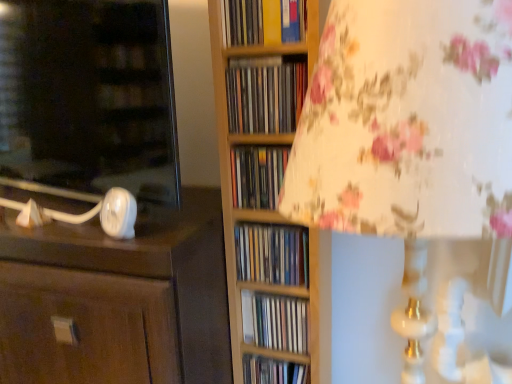
Locate an element on the screen. The height and width of the screenshot is (384, 512). matte plastic books at center, the 4th book from the bottom is located at coordinates (257, 175).

The height and width of the screenshot is (384, 512). What are the coordinates of `wooden cd case at center, the fifth book in the bottom-to-top sequence` in the screenshot? It's located at (265, 97).

This screenshot has width=512, height=384. In order to click on matte plastic books at center, which appears as the 3th book when ordered from the bottom in this screenshot , I will do `click(272, 254)`.

What do you see at coordinates (263, 21) in the screenshot? The image size is (512, 384). I see `yellow paperback book at upper center, acting as the sixth book starting from the bottom` at bounding box center [263, 21].

This screenshot has width=512, height=384. I want to click on matte plastic books at center, which is the 5th book in top-to-bottom order, so click(x=275, y=322).

How distant is matte plastic books at center, the 1th book from the bottom, from matte brown cabinet at left?

14.63 inches.

From a real-world perspective, who is located lower, matte plastic books at center, which ranks as the sixth book in top-to-bottom order, or matte brown cabinet at left?

From a 3D spatial view, matte plastic books at center, which ranks as the sixth book in top-to-bottom order, is below.

Could you tell me if matte plastic books at center, the 1th book from the bottom, is turned towards matte brown cabinet at left?

No, matte plastic books at center, the 1th book from the bottom, is not oriented towards matte brown cabinet at left.

Identify the location of chest of drawers in front of the matte plastic books at center, which ranks as the sixth book in top-to-bottom order. (118, 299).

Which is more to the left, matte plastic books at center, which is the 5th book in top-to-bottom order, or matte plastic books at center, which ranks as the sixth book in top-to-bottom order?

matte plastic books at center, which is the 5th book in top-to-bottom order.

From the image's perspective, between matte plastic books at center, which is the second book in bottom-to-top order, and matte plastic books at center, which ranks as the sixth book in top-to-bottom order, which one is located above?

From the image's view, matte plastic books at center, which is the second book in bottom-to-top order, is above.

Between matte plastic books at center, which is the second book in bottom-to-top order, and matte plastic books at center, which ranks as the sixth book in top-to-bottom order, which one is positioned in front?

matte plastic books at center, which is the second book in bottom-to-top order.

From a real-world perspective, is matte plastic books at center, which ranks as the sixth book in top-to-bottom order, on top of matte plastic books at center, which appears as the 3th book when ordered from the bottom?

No, from a real-world perspective, matte plastic books at center, which ranks as the sixth book in top-to-bottom order, is not over matte plastic books at center, which appears as the 3th book when ordered from the bottom

Between point (273, 376) and point (271, 245), which one is positioned in front?

The point (271, 245) is more forward.

Are matte plastic books at center, which ranks as the sixth book in top-to-bottom order, and matte plastic books at center, which appears as the 3th book when ordered from the bottom, beside each other?

No.

Is matte plastic books at center, which appears as the 3th book when ordered from the bottom, at the back of matte white lamp base at left?

No, matte white lamp base at left's orientation is not away from matte plastic books at center, which appears as the 3th book when ordered from the bottom.

Does matte white lamp base at left have a smaller size compared to matte plastic books at center, which appears as the 4th book when viewed from the top?

Actually, matte white lamp base at left might be larger than matte plastic books at center, which appears as the 4th book when viewed from the top.

From the image's perspective, is matte white lamp base at left above or below matte plastic books at center, which appears as the 4th book when viewed from the top?

Clearly, from the image's perspective, matte white lamp base at left is above matte plastic books at center, which appears as the 4th book when viewed from the top.

Between point (146, 109) and point (284, 272), which one is positioned in front?

The point (146, 109) is closer.

Is yellow paperback book at upper center, acting as the sixth book starting from the bottom, facing towards matte plastic books at center, which ranks as the sixth book in top-to-bottom order?

No.

Measure the distance from yellow paperback book at upper center, positioned as the first book in top-to-bottom order, to matte plastic books at center, the 1th book from the bottom.

yellow paperback book at upper center, positioned as the first book in top-to-bottom order, is 27.95 inches from matte plastic books at center, the 1th book from the bottom.

Is matte plastic books at center, the 1th book from the bottom, completely or partially inside yellow paperback book at upper center, acting as the sixth book starting from the bottom?

No, matte plastic books at center, the 1th book from the bottom, is not inside yellow paperback book at upper center, acting as the sixth book starting from the bottom.

Is the surface of yellow paperback book at upper center, positioned as the first book in top-to-bottom order, in direct contact with matte plastic books at center, the 1th book from the bottom?

No, yellow paperback book at upper center, positioned as the first book in top-to-bottom order, is not touching matte plastic books at center, the 1th book from the bottom.

Is matte plastic books at center, the 4th book from the bottom, next to yellow paperback book at upper center, positioned as the first book in top-to-bottom order?

matte plastic books at center, the 4th book from the bottom, and yellow paperback book at upper center, positioned as the first book in top-to-bottom order, are not in contact.

From the picture: Considering the sizes of matte plastic books at center, the 4th book from the bottom, and yellow paperback book at upper center, acting as the sixth book starting from the bottom, in the image, is matte plastic books at center, the 4th book from the bottom, wider or thinner than yellow paperback book at upper center, acting as the sixth book starting from the bottom,?

matte plastic books at center, the 4th book from the bottom, is thinner than yellow paperback book at upper center, acting as the sixth book starting from the bottom.

Is matte plastic books at center, placed as the 3th book when sorted from top to bottom, closer to camera compared to yellow paperback book at upper center, positioned as the first book in top-to-bottom order?

No, matte plastic books at center, placed as the 3th book when sorted from top to bottom, is further to the viewer.

Starting from the yellow paperback book at upper center, acting as the sixth book starting from the bottom, which book is the 2nd one behind? Please provide its 2D coordinates.

[(257, 175)]

Can you confirm if matte brown cabinet at left is thinner than matte plastic books at center, which ranks as the sixth book in top-to-bottom order?

No, matte brown cabinet at left is not thinner than matte plastic books at center, which ranks as the sixth book in top-to-bottom order.

Can you confirm if matte brown cabinet at left is taller than matte plastic books at center, the 1th book from the bottom?

Correct, matte brown cabinet at left is much taller as matte plastic books at center, the 1th book from the bottom.

Is matte brown cabinet at left positioned with its back to matte plastic books at center, which ranks as the sixth book in top-to-bottom order?

No, matte plastic books at center, which ranks as the sixth book in top-to-bottom order, is not at the back of matte brown cabinet at left.

Is the depth of matte brown cabinet at left less than that of matte plastic books at center, the 1th book from the bottom?

Yes, matte brown cabinet at left is closer to the camera.

The image size is (512, 384). I want to click on the 6th book behind when counting from the matte brown cabinet at left, so click(273, 371).

Locate an element on the screen. book that is the 1st object to the left of the matte plastic books at center, which ranks as the sixth book in top-to-bottom order, starting at the anchor is located at coordinates (275, 322).

Estimate the real-world distances between objects in this image. Which object is further from matte plastic books at center, which ranks as the sixth book in top-to-bottom order, matte white lamp base at left or matte brown cabinet at left?

Among the two, matte white lamp base at left is located further to matte plastic books at center, which ranks as the sixth book in top-to-bottom order.

Estimate the real-world distances between objects in this image. Which object is closer to matte brown cabinet at left, matte plastic books at center, which is the 5th book in top-to-bottom order, or matte plastic books at center, the 4th book from the bottom?

matte plastic books at center, which is the 5th book in top-to-bottom order, is positioned closer to the anchor matte brown cabinet at left.

Looking at this image, considering their positions, is matte plastic books at center, placed as the 3th book when sorted from top to bottom, positioned closer to matte plastic books at center, which ranks as the sixth book in top-to-bottom order, than matte white lamp base at left?

matte plastic books at center, placed as the 3th book when sorted from top to bottom, is closer to matte plastic books at center, which ranks as the sixth book in top-to-bottom order.

Based on their spatial positions, is matte plastic books at center, which appears as the 4th book when viewed from the top, or matte white lamp base at left further from matte plastic books at center, placed as the 3th book when sorted from top to bottom?

matte white lamp base at left lies further to matte plastic books at center, placed as the 3th book when sorted from top to bottom, than the other object.

Which object lies further to the anchor point matte plastic books at center, which is the 5th book in top-to-bottom order, matte plastic books at center, which ranks as the sixth book in top-to-bottom order, or matte white lamp base at left?

matte white lamp base at left lies further to matte plastic books at center, which is the 5th book in top-to-bottom order, than the other object.

Based on their spatial positions, is matte plastic books at center, the 1th book from the bottom, or matte white lamp base at left closer to matte plastic books at center, which appears as the 4th book when viewed from the top?

Based on the image, matte plastic books at center, the 1th book from the bottom, appears to be nearer to matte plastic books at center, which appears as the 4th book when viewed from the top.

Which object lies nearer to the anchor point matte plastic books at center, which appears as the 3th book when ordered from the bottom, yellow paperback book at upper center, positioned as the first book in top-to-bottom order, or matte white lamp base at left?

matte white lamp base at left is closer to matte plastic books at center, which appears as the 3th book when ordered from the bottom.

Which object lies further to the anchor point matte plastic books at center, the 4th book from the bottom, yellow paperback book at upper center, positioned as the first book in top-to-bottom order, or matte plastic books at center, the 1th book from the bottom?

matte plastic books at center, the 1th book from the bottom.

Where is `cabinetry that lies between yellow paperback book at upper center, positioned as the first book in top-to-bottom order, and matte plastic books at center, which ranks as the sixth book in top-to-bottom order, from top to bottom`? The height and width of the screenshot is (384, 512). cabinetry that lies between yellow paperback book at upper center, positioned as the first book in top-to-bottom order, and matte plastic books at center, which ranks as the sixth book in top-to-bottom order, from top to bottom is located at coordinates (89, 96).

Identify the location of cabinetry between yellow paperback book at upper center, positioned as the first book in top-to-bottom order, and matte brown cabinet at left vertically. The image size is (512, 384). (89, 96).

At what (x,y) coordinates should I click in order to perform the action: click on cabinetry between wooden cd case at center, the fifth book in the bottom-to-top sequence, and matte plastic books at center, which ranks as the sixth book in top-to-bottom order, in the vertical direction. Please return your answer as a coordinate pair (x, y). The image size is (512, 384). Looking at the image, I should click on (89, 96).

Where is `chest of drawers between wooden cd case at center, arranged as the second book when viewed from the top, and matte plastic books at center, the 1th book from the bottom, from top to bottom`? The width and height of the screenshot is (512, 384). chest of drawers between wooden cd case at center, arranged as the second book when viewed from the top, and matte plastic books at center, the 1th book from the bottom, from top to bottom is located at coordinates (118, 299).